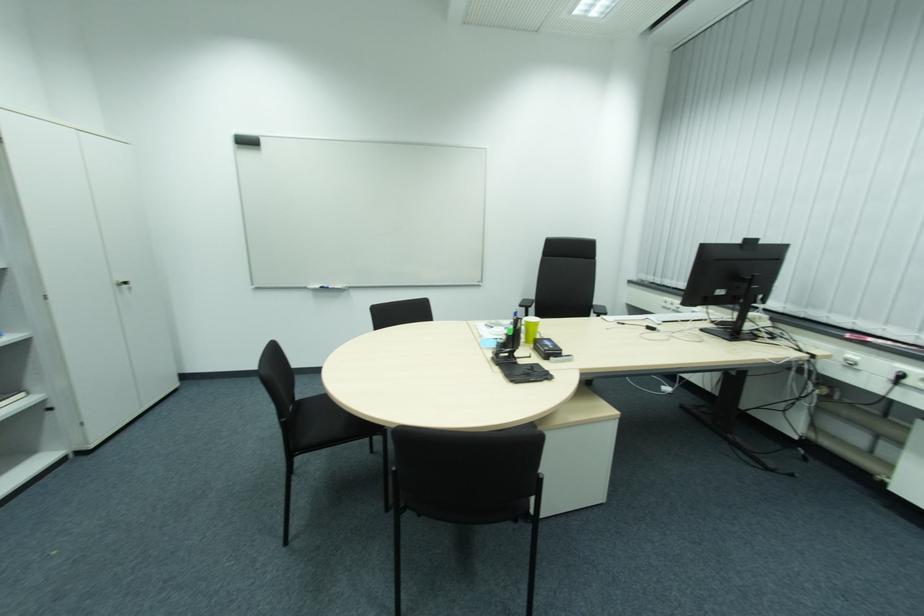
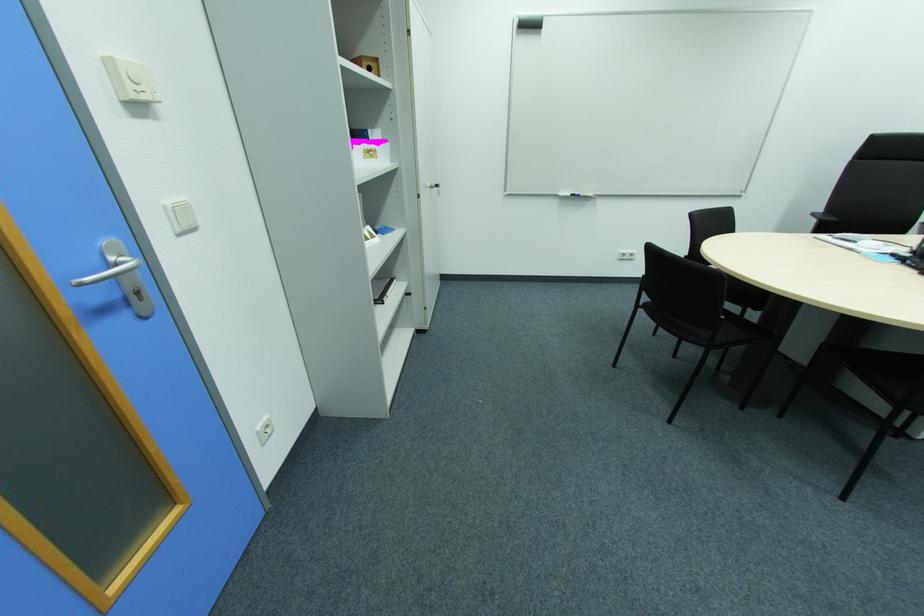
In the second image, find the point that corresponds to (x=335, y=288) in the first image.

(588, 195)